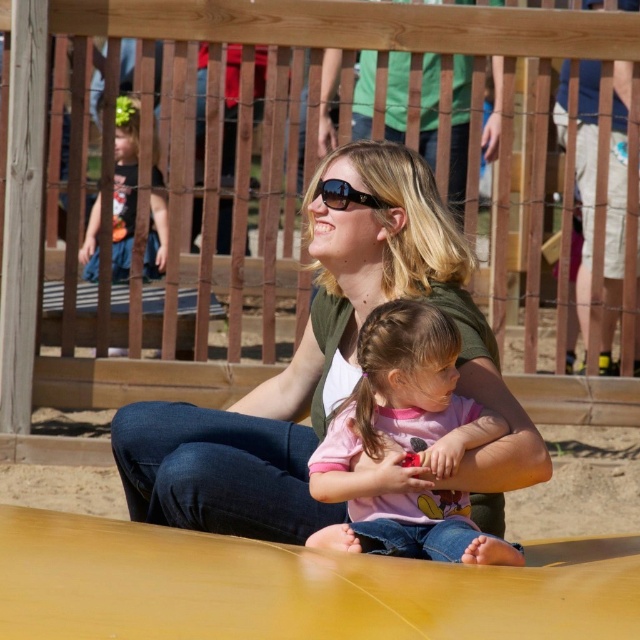
Question: Is matte green shirt at center closer to camera compared to matte black shirt at upper left?

Choices:
 (A) yes
 (B) no

Answer: (A)

Question: Is matte green shirt at center bigger than pink matte shirt at center?

Choices:
 (A) yes
 (B) no

Answer: (A)

Question: Considering the relative positions of matte green shirt at center and pink matte shirt at center in the image provided, where is matte green shirt at center located with respect to pink matte shirt at center?

Choices:
 (A) left
 (B) right

Answer: (A)

Question: Which point is farther to the camera?

Choices:
 (A) matte black shirt at upper left
 (B) pink matte shirt at center

Answer: (A)

Question: Which object appears farthest from the camera in this image?

Choices:
 (A) pink matte shirt at center
 (B) matte black shirt at upper left
 (C) sunglasses at center
 (D) matte green shirt at center

Answer: (B)

Question: Which is farther from the matte green shirt at center?

Choices:
 (A) sunglasses at center
 (B) matte black shirt at upper left
 (C) pink matte shirt at center

Answer: (B)